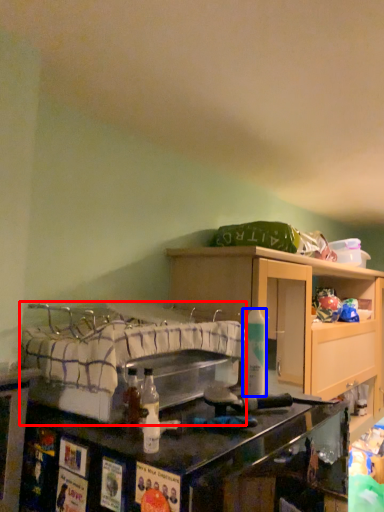
Question: Which object is further to the camera taking this photo, bed (highlighted by a red box) or bottle (highlighted by a blue box)?

Choices:
 (A) bed
 (B) bottle

Answer: (B)